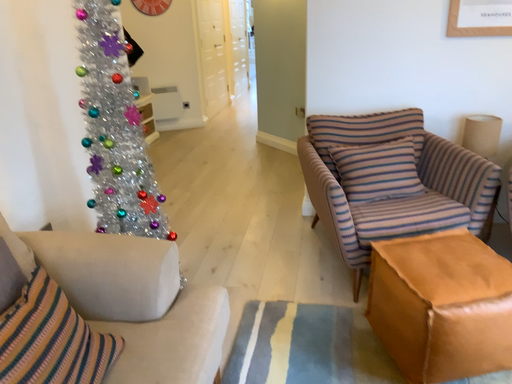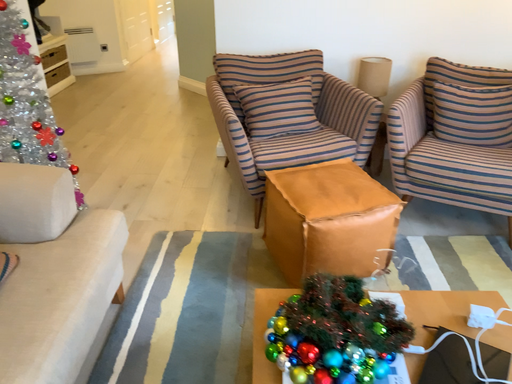
Question: Which way did the camera rotate in the video?

Choices:
 (A) rotated right
 (B) rotated left

Answer: (A)